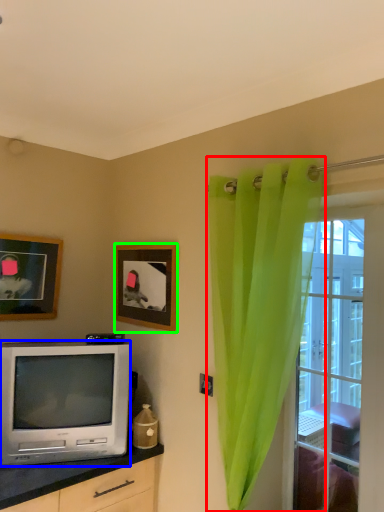
Question: Which object is the farthest from curtain (highlighted by a red box)? Choose among these: television (highlighted by a blue box) or picture frame (highlighted by a green box).

Choices:
 (A) television
 (B) picture frame

Answer: (A)